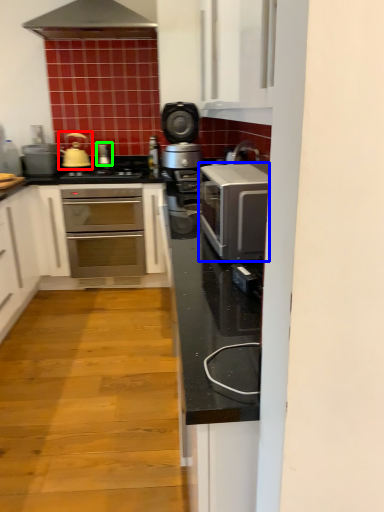
Question: Based on their relative distances, which object is nearer to tea pot (highlighted by a red box)? Choose from kitchen appliance (highlighted by a blue box) and appliance (highlighted by a green box).

Choices:
 (A) kitchen appliance
 (B) appliance

Answer: (B)